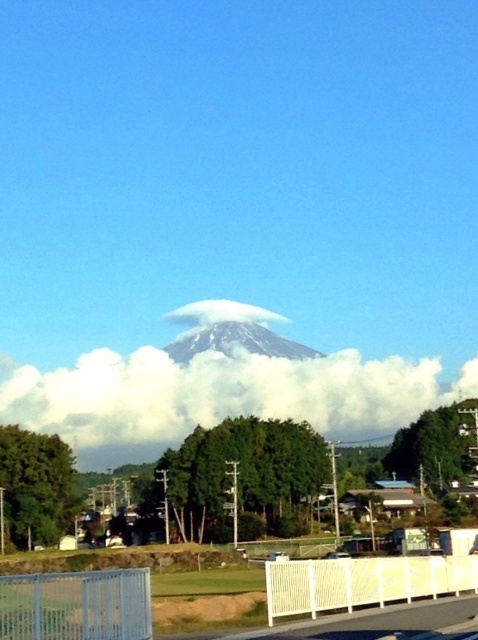
Between point (292, 371) and point (212, 342), which one is positioned in front?

Point (292, 371) is more forward.

Which is below, white fluffy cloud at center or white snow-covered mountain at center?

white fluffy cloud at center is lower down.

Which is behind, point (365, 417) or point (180, 340)?

The point (180, 340) is behind.

The image size is (478, 640). What are the coordinates of `white fluffy cloud at center` in the screenshot? It's located at [x=221, y=394].